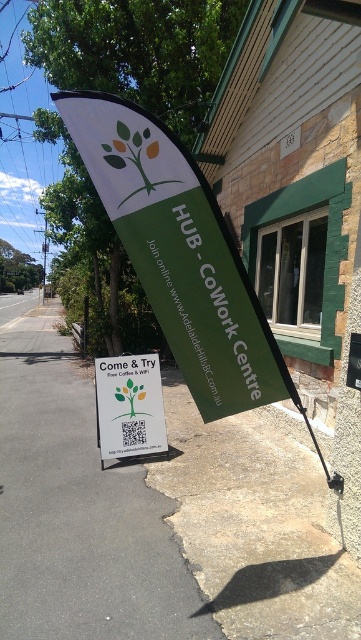
Is gray concrete pavement at center smaller than white paper sign at center?

Incorrect, gray concrete pavement at center is not smaller in size than white paper sign at center.

Which is above, gray concrete pavement at center or white paper sign at center?

white paper sign at center is higher up.

Is point (197, 616) in front of point (107, 376)?

That is True.

This screenshot has width=361, height=640. Find the location of `gray concrete pavement at center`. gray concrete pavement at center is located at coordinates coord(79,509).